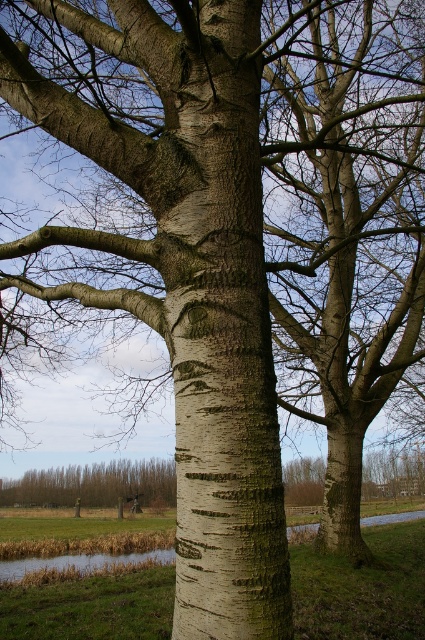
Consider the image. You are standing in front of the birch tree and want to take a photo of the white bark tree trunk at center. Where should you position your camera to capture the trunk in the center of the frame?

Position your camera at the point directly facing the white bark tree trunk at center, which is located at the coordinates (218, 323), to ensure it appears centered in your photo.

You are a painter standing 1.5 meters away from the white bark tree trunk at center. You want to move closer to capture the texture details. How much closer can you get before you are right next to it?

The white bark tree trunk at center is 2.03 meters away from you. Since you are currently 1.5 meters away, you can move 0.53 meters closer to reach the trunk.

From the picture: You are standing in the birch tree scene. There are two points marked in the image. The first point is at coordinates point (226, 413) and the second point is at point (101, 481). Which point is closer to you?

Point (226, 413) is in front of point (101, 481), so it is closer to you.